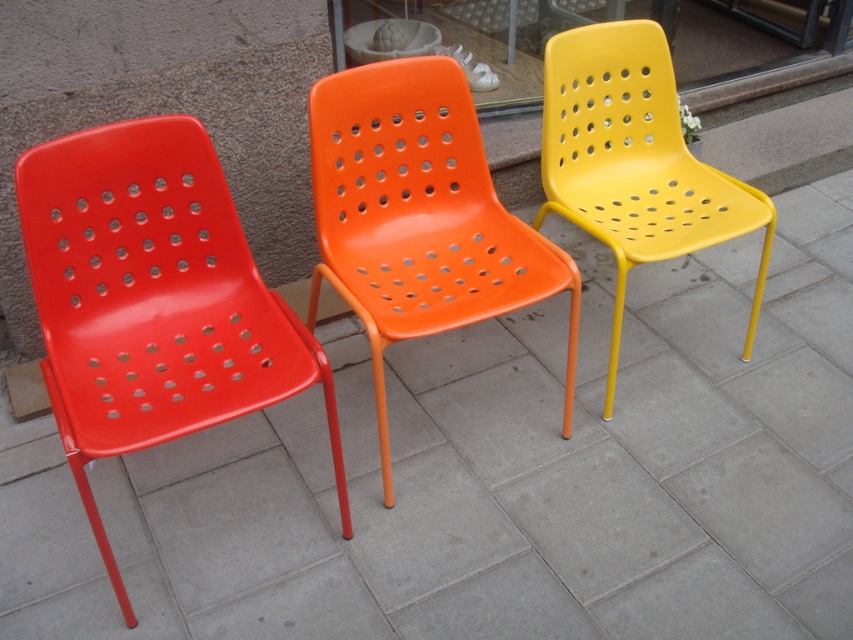
The height and width of the screenshot is (640, 853). What are the coordinates of `orange plastic chair at center` in the screenshot? It's located at (418, 216).

Does glossy plastic chairs at center have a greater height compared to matte plastic chair at left?

Yes, glossy plastic chairs at center is taller than matte plastic chair at left.

Who is lower down, glossy plastic chairs at center or matte plastic chair at left?

Positioned lower is glossy plastic chairs at center.

Between point (793, 392) and point (22, 225), which one is positioned in front?

Positioned in front is point (22, 225).

The width and height of the screenshot is (853, 640). I want to click on glossy plastic chairs at center, so click(496, 476).

Can you confirm if glossy plastic chairs at center is wider than yellow matte plastic chair at right?

Yes.

Does glossy plastic chairs at center lie in front of yellow matte plastic chair at right?

Yes.

Which is behind, point (373, 422) or point (633, 81)?

The point (633, 81) is behind.

Image resolution: width=853 pixels, height=640 pixels. I want to click on glossy plastic chairs at center, so click(496, 476).